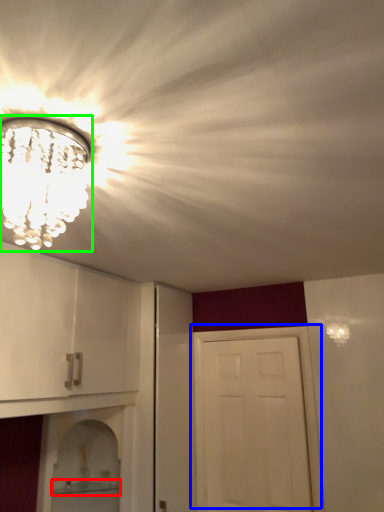
Question: Based on their relative distances, which object is nearer to shelf (highlighted by a red box)? Choose from door (highlighted by a blue box) and light fixture (highlighted by a green box).

Choices:
 (A) door
 (B) light fixture

Answer: (A)